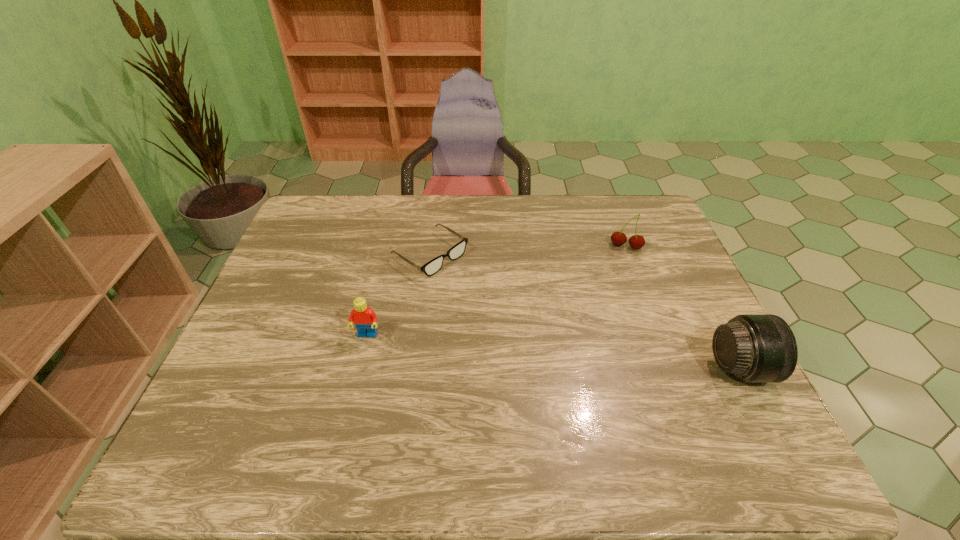
Find the location of a particular element. free space on the desktop that is between the Lego and the tallest object and is positioned on the surface of the cherry is located at coordinates (597, 356).

Locate an element on the screen. Image resolution: width=960 pixels, height=540 pixels. free spot on the desktop that is between the Lego and the telephoto lens and is positioned on the front-facing side of the spectacles is located at coordinates (585, 355).